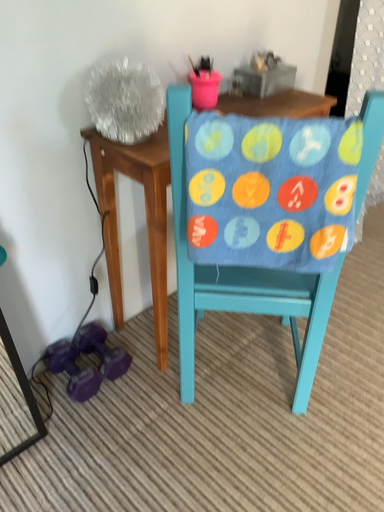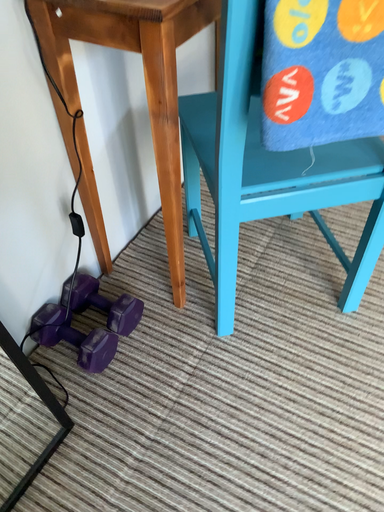
Question: How did the camera likely rotate when shooting the video?

Choices:
 (A) rotated downward
 (B) rotated upward

Answer: (A)